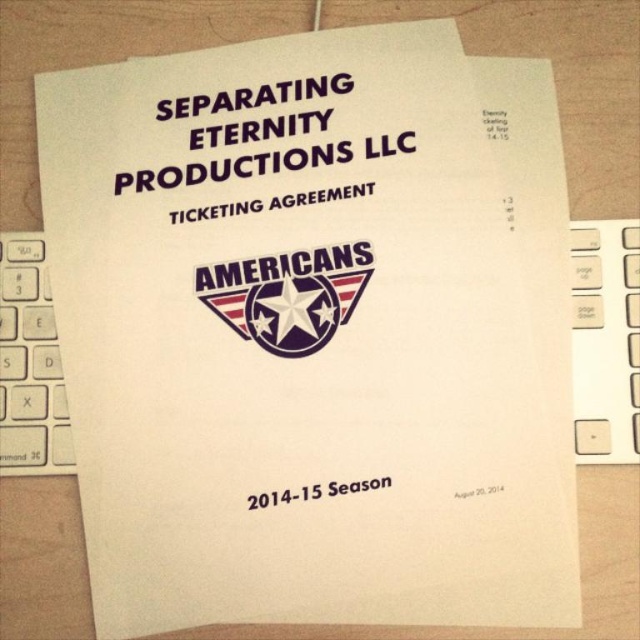
Question: Which of the following is the farthest from the observer?

Choices:
 (A) white plastic keyboard at upper center
 (B) metallic silver star at center

Answer: (B)

Question: Which point is closer to the camera?

Choices:
 (A) (355, 289)
 (B) (620, 355)

Answer: (B)

Question: Is the position of white plastic keyboard at upper center more distant than that of metallic silver star at center?

Choices:
 (A) no
 (B) yes

Answer: (A)

Question: Is white plastic keyboard at upper center closer to the viewer compared to metallic silver star at center?

Choices:
 (A) yes
 (B) no

Answer: (A)

Question: Is white plastic keyboard at upper center positioned before metallic silver star at center?

Choices:
 (A) no
 (B) yes

Answer: (B)

Question: Which object is closer to the camera taking this photo?

Choices:
 (A) metallic silver star at center
 (B) white plastic keyboard at upper center

Answer: (B)